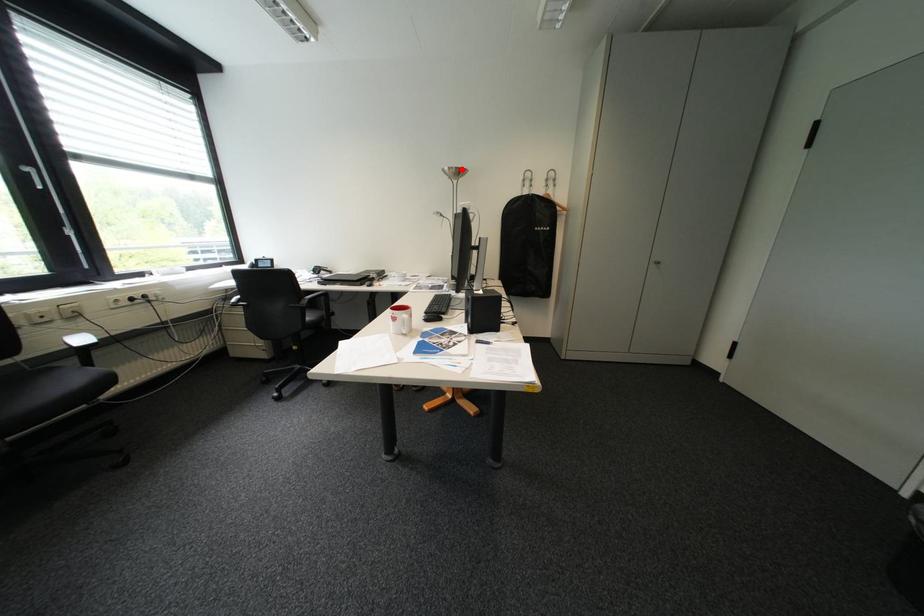
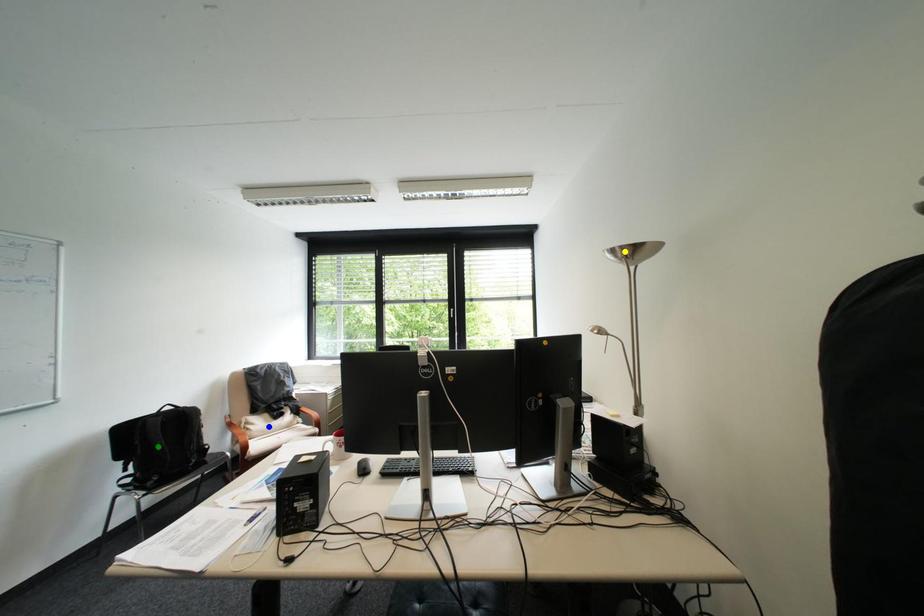
Question: I am providing you with two images of the same scene from different viewpoints. A red point is marked on the first image. You are given multiple points on the second image. Which spot in image 2 lines up with the point in image 1?

Choices:
 (A) yellow point
 (B) blue point
 (C) green point

Answer: (A)